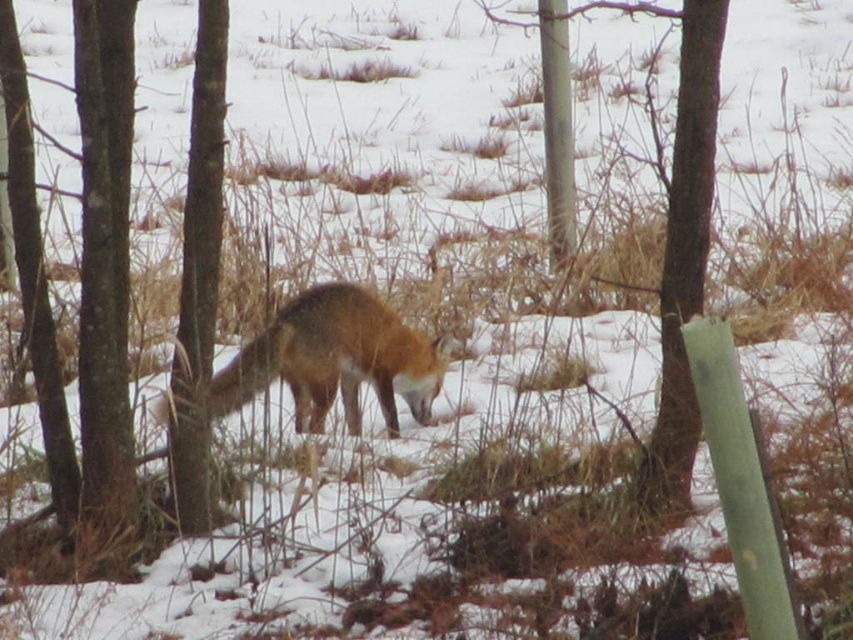
You are a hiker lost in the snowy forest and see a fox at point (674,228). What is located at that point?

At point (674,228) lies brown wood tree at center.

You are a hiker in a snowy forest and see the brown wood tree at center and the smooth bark tree at center. Which tree is shorter?

The brown wood tree at center is shorter than the smooth bark tree at center.